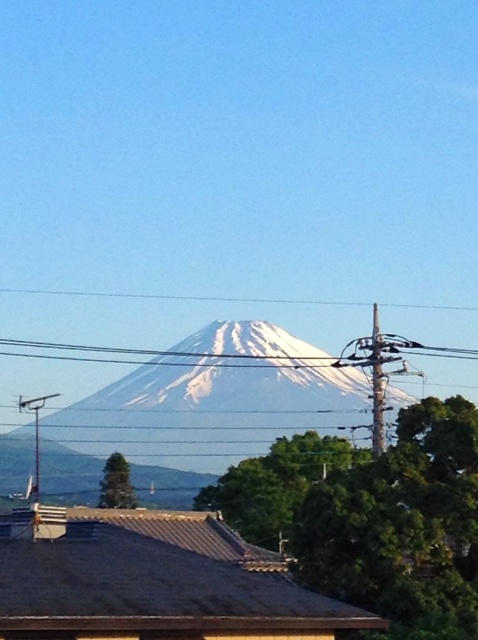
Question: Can you confirm if white snow-covered mountain at center is bigger than black wire at center?

Choices:
 (A) no
 (B) yes

Answer: (B)

Question: Does white snow-covered mountain at center appear under black wire at center?

Choices:
 (A) no
 (B) yes

Answer: (B)

Question: Which object is farther from the camera taking this photo?

Choices:
 (A) black wire at center
 (B) white snow-covered mountain at center

Answer: (A)

Question: Which point is farther from the camera taking this photo?

Choices:
 (A) (414, 346)
 (B) (336, 416)

Answer: (B)

Question: Does white snow-covered mountain at center have a larger size compared to black wire at center?

Choices:
 (A) yes
 (B) no

Answer: (A)